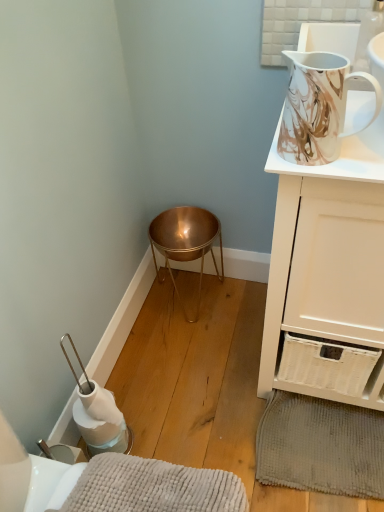
Question: Is gray textured bath mat at lower right, which appears as the 1th bath mat when viewed from the back, aimed at marble-patterned ceramic jug at upper right?

Choices:
 (A) no
 (B) yes

Answer: (A)

Question: Is the depth of gray textured bath mat at lower right, acting as the 1th bath mat starting from the right, greater than that of marble-patterned ceramic jug at upper right?

Choices:
 (A) yes
 (B) no

Answer: (A)

Question: Is gray textured bath mat at lower right, arranged as the 2th bath mat when viewed from the left, closer to camera compared to marble-patterned ceramic jug at upper right?

Choices:
 (A) no
 (B) yes

Answer: (A)

Question: Can you confirm if gray textured bath mat at lower right, acting as the 1th bath mat starting from the right, is smaller than marble-patterned ceramic jug at upper right?

Choices:
 (A) yes
 (B) no

Answer: (B)

Question: Is marble-patterned ceramic jug at upper right completely or partially inside gray textured bath mat at lower right, the 2th bath mat in the front-to-back sequence?

Choices:
 (A) yes
 (B) no

Answer: (B)

Question: Considering the positions of point click(266, 421) and point click(314, 133), is point click(266, 421) closer or farther from the camera than point click(314, 133)?

Choices:
 (A) farther
 (B) closer

Answer: (A)

Question: From a real-world perspective, is gray textured bath mat at lower right, arranged as the 2th bath mat when viewed from the left, physically located above or below marble-patterned ceramic jug at upper right?

Choices:
 (A) above
 (B) below

Answer: (B)

Question: Relative to marble-patterned ceramic jug at upper right, is gray textured bath mat at lower right, acting as the 1th bath mat starting from the right, in front or behind?

Choices:
 (A) front
 (B) behind

Answer: (B)

Question: Would you say gray textured bath mat at lower right, which appears as the 1th bath mat when viewed from the back, is to the left or to the right of marble-patterned ceramic jug at upper right in the picture?

Choices:
 (A) right
 (B) left

Answer: (A)

Question: From a real-world perspective, is white glossy cabinet at upper right above or below soft gray plush bath mat at lower left, which is the first bath mat in left-to-right order?

Choices:
 (A) below
 (B) above

Answer: (B)

Question: Based on their positions, is white glossy cabinet at upper right located to the left or right of soft gray plush bath mat at lower left, the second bath mat positioned from the back?

Choices:
 (A) left
 (B) right

Answer: (B)

Question: Based on their sizes in the image, would you say white glossy cabinet at upper right is bigger or smaller than soft gray plush bath mat at lower left, arranged as the second bath mat when viewed from the right?

Choices:
 (A) big
 (B) small

Answer: (A)

Question: Considering the positions of white glossy cabinet at upper right and soft gray plush bath mat at lower left, arranged as the second bath mat when viewed from the right, in the image, is white glossy cabinet at upper right wider or thinner than soft gray plush bath mat at lower left, arranged as the second bath mat when viewed from the right,?

Choices:
 (A) thin
 (B) wide

Answer: (B)

Question: Based on their sizes in the image, would you say white glossy cabinet at upper right is bigger or smaller than gray textured bath mat at lower right, which appears as the 1th bath mat when viewed from the back?

Choices:
 (A) big
 (B) small

Answer: (A)

Question: Is point (273, 365) positioned closer to the camera than point (340, 456)?

Choices:
 (A) closer
 (B) farther

Answer: (B)